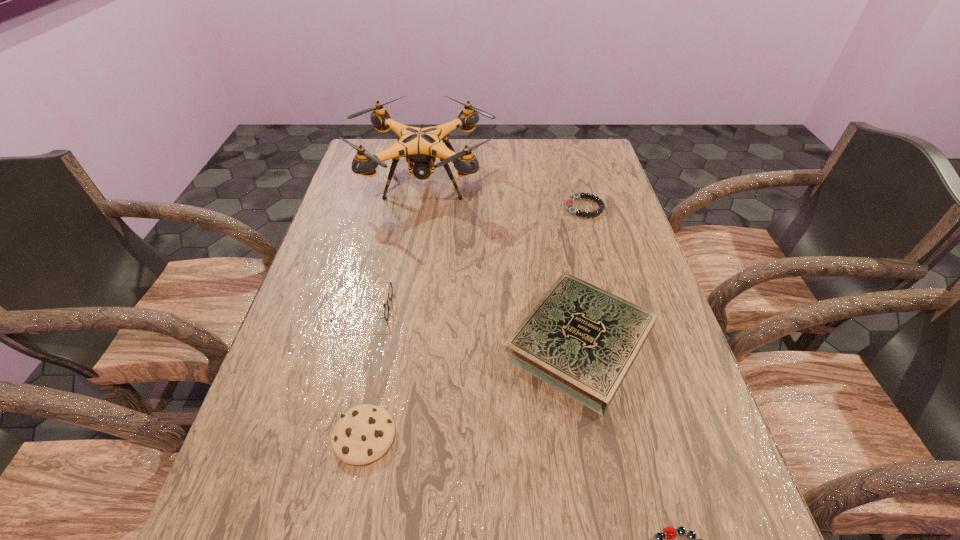
Locate an element on the screen. the tallest object is located at coordinates (421, 146).

Find the location of a particular element. Image resolution: width=960 pixels, height=540 pixels. the fifth shortest object is located at coordinates (582, 340).

Where is `sunglasses`? sunglasses is located at coordinates (386, 311).

Find the location of `cookie`. cookie is located at coordinates (362, 435).

You are a GUI agent. You are given a task and a screenshot of the screen. Output one action in this format:
    pyautogui.click(x=<x>, y=<y>)
    Task: Click on the farther bracelet
    The image size is (960, 540).
    Given the screenshot: What is the action you would take?
    pyautogui.click(x=569, y=202)

Image resolution: width=960 pixels, height=540 pixels. Find the location of `the fifth tallest object`. the fifth tallest object is located at coordinates (569, 202).

Locate an element on the screen. The height and width of the screenshot is (540, 960). blank area located on the camera mount of the tallest object is located at coordinates (412, 263).

Identify the location of vacant space located 0.050m on the back of the second tallest object. (565, 271).

Locate an element on the screen. vacant space located on the front-facing side of the sunglasses is located at coordinates (530, 307).

The height and width of the screenshot is (540, 960). I want to click on free space located 0.370m on the right of the cookie, so click(595, 437).